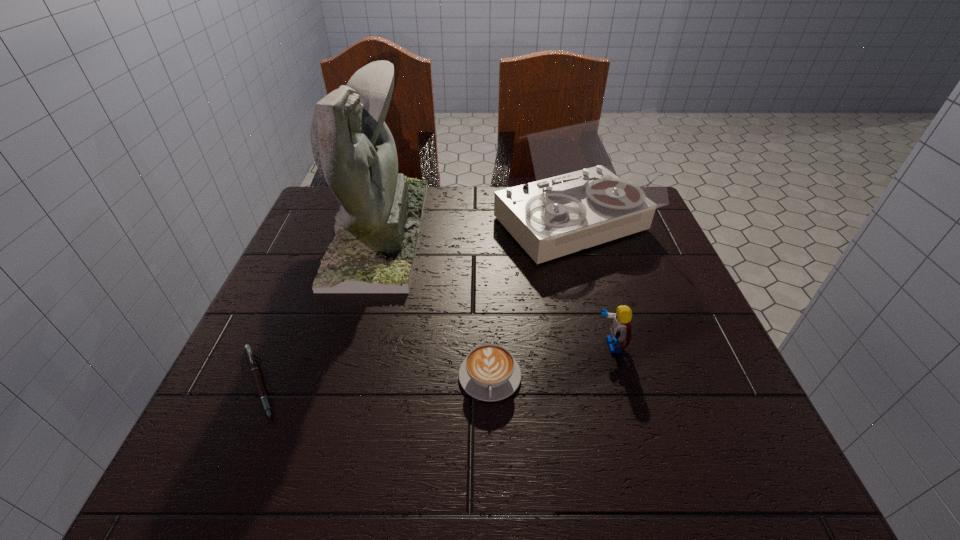
The image size is (960, 540). In order to click on sculpture in this screenshot , I will do `click(377, 227)`.

Where is `the second tallest object`? The image size is (960, 540). the second tallest object is located at coordinates (597, 181).

Locate an element on the screen. the third shortest object is located at coordinates (621, 327).

The height and width of the screenshot is (540, 960). Find the location of `the fourth tallest object`. the fourth tallest object is located at coordinates tap(489, 372).

Find the location of `the shortest object`. the shortest object is located at coordinates (250, 356).

At what (x,y) coordinates should I click in order to perform the action: click on free space located 0.250m on the base of the sculpture. Please return your answer as a coordinate pair (x, y). Looking at the image, I should click on (517, 231).

Identify the location of free space located 0.170m on the left of the record player. tap(428, 227).

Find the location of `vacant space located 0.100m on the front-facing side of the Lego`. vacant space located 0.100m on the front-facing side of the Lego is located at coordinates (546, 346).

This screenshot has height=540, width=960. I want to click on vacant position located on the front-facing side of the Lego, so click(x=484, y=346).

Find the location of a particular element. This screenshot has width=960, height=540. vacant space located on the front-facing side of the Lego is located at coordinates (571, 346).